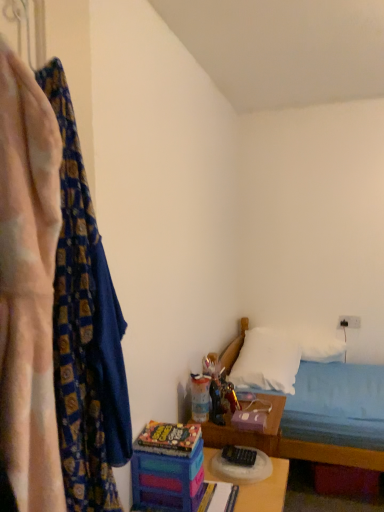
Question: Do you think white soft pillow at lower right, the 2th pillow in the back-to-front sequence, is within white soft pillow at upper right, the first pillow in the back-to-front sequence, or outside of it?

Choices:
 (A) outside
 (B) inside

Answer: (A)

Question: In the image, is white soft pillow at lower right, the 2th pillow in the back-to-front sequence, positioned in front of or behind white soft pillow at upper right, the first pillow in the back-to-front sequence?

Choices:
 (A) front
 (B) behind

Answer: (A)

Question: Considering the real-world distances, which object is farthest from the white soft pillow at lower right, the 2th pillow in the back-to-front sequence?

Choices:
 (A) multicolored plastic toy at lower center, which is the 1th toy in left-to-right order
 (B) patterned fabric curtain at left, the first curtain viewed from the back
 (C) white fabric bed at lower right
 (D) multicolored plastic table at center
 (E) translucent plastic toy at center, marked as the first toy in a right-to-left arrangement

Answer: (B)

Question: Which is nearer to the patterned fabric curtain at left, which ranks as the 1th curtain in front-to-back order?

Choices:
 (A) multicolored plastic table at center
 (B) white soft pillow at lower right, the 1th pillow from the front
 (C) translucent plastic toy at center, positioned as the 2th toy in left-to-right order
 (D) multicolored plastic toy at lower center, which is the 1th toy in left-to-right order
 (E) white soft pillow at upper right, the first pillow in the back-to-front sequence

Answer: (D)